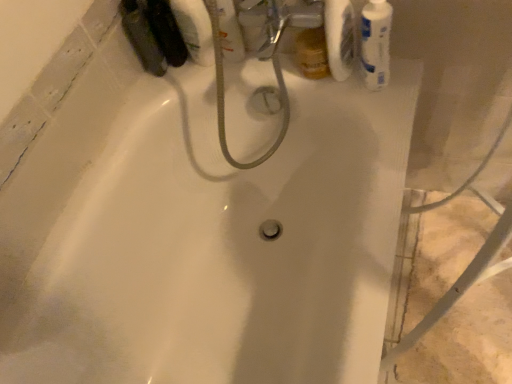
Where is `vacant space to the left of clear plastic bottle at upper center, marked as the 2th mouthwash in a left-to-right arrangement`? The image size is (512, 384). vacant space to the left of clear plastic bottle at upper center, marked as the 2th mouthwash in a left-to-right arrangement is located at coordinates (178, 72).